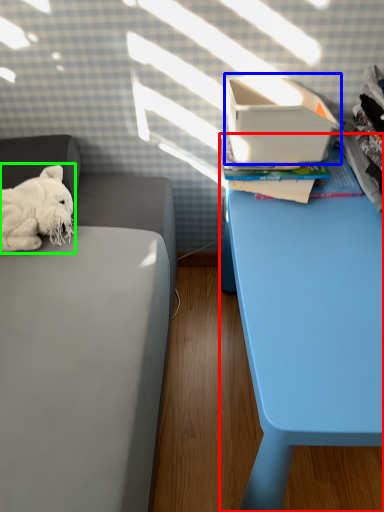
Question: Which object is the closest to the table (highlighted by a red box)? Choose among these: shoe box (highlighted by a blue box) or dog (highlighted by a green box).

Choices:
 (A) shoe box
 (B) dog

Answer: (A)